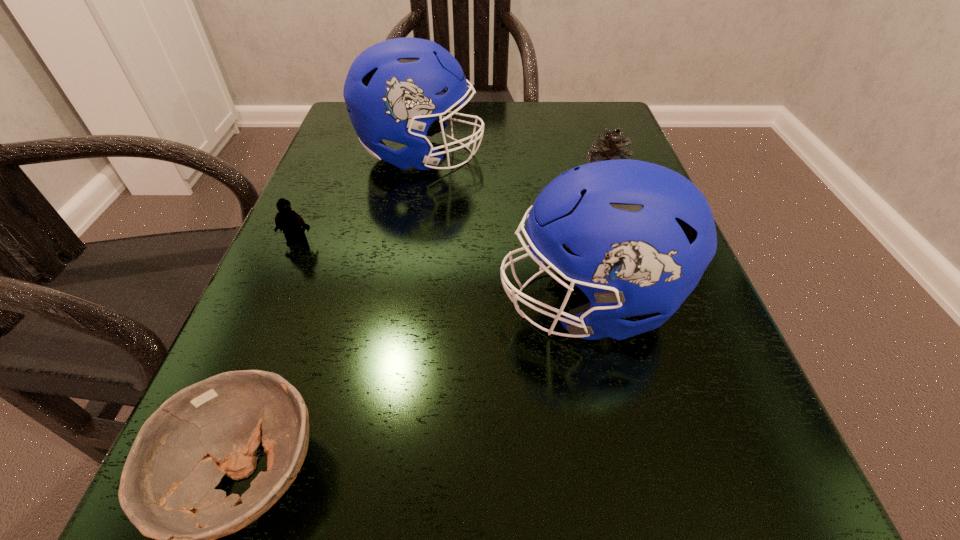
You are a GUI agent. You are given a task and a screenshot of the screen. Output one action in this format:
    pyautogui.click(x=<x>, y=<y>)
    Task: Click on the left football helmet
    This screenshot has width=960, height=540.
    Given the screenshot: What is the action you would take?
    pyautogui.click(x=390, y=90)

The width and height of the screenshot is (960, 540). Find the location of `the nearer football helmet`. the nearer football helmet is located at coordinates (636, 237).

The width and height of the screenshot is (960, 540). In order to click on the second nearest object in this screenshot , I will do `click(636, 237)`.

Locate an element on the screen. The height and width of the screenshot is (540, 960). pinecone is located at coordinates (611, 143).

The image size is (960, 540). What are the coordinates of `Lego` in the screenshot? It's located at (293, 226).

Locate an element on the screen. The image size is (960, 540). vacant space situated 0.140m on the face guard of the left football helmet is located at coordinates (552, 156).

Locate an element on the screen. The width and height of the screenshot is (960, 540). free space located 0.240m on the front-facing side of the nearer football helmet is located at coordinates (331, 303).

The height and width of the screenshot is (540, 960). What are the coordinates of `vacant point located on the front-facing side of the nearer football helmet` in the screenshot? It's located at (297, 303).

I want to click on vacant position located on the front-facing side of the nearer football helmet, so click(x=373, y=303).

Locate an element on the screen. The image size is (960, 540). free space located 0.170m on the back of the pinecone is located at coordinates (x=586, y=129).